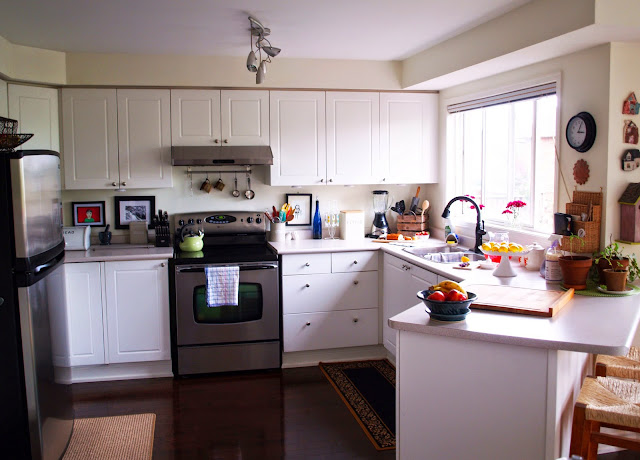
Image resolution: width=640 pixels, height=460 pixels. Find the location of `oven`. oven is located at coordinates (265, 302).